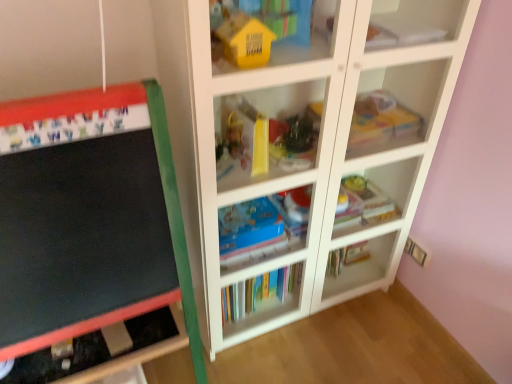
Identify the location of free location above translucent plastic toy at upper right, the third toy viewed from the front (from a real-world perspective). The height and width of the screenshot is (384, 512). (377, 114).